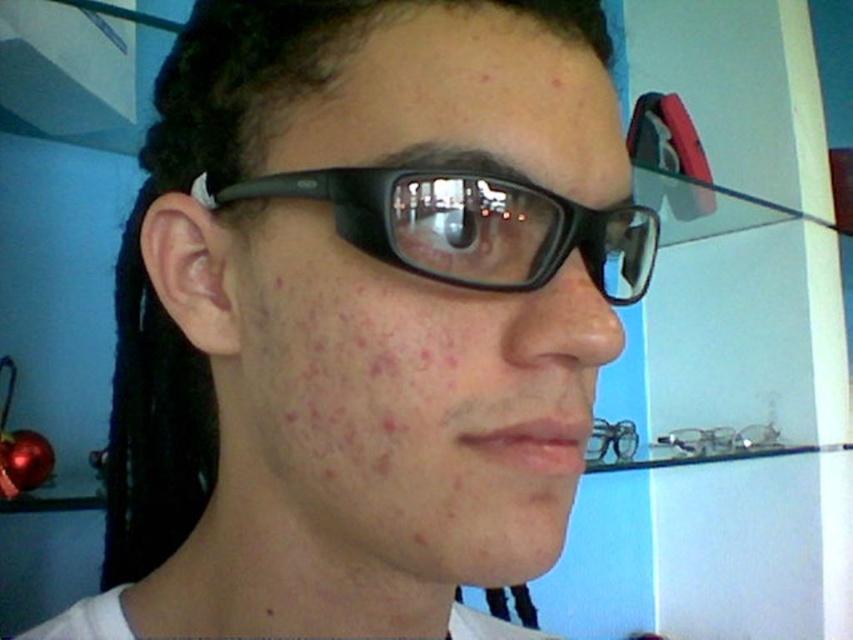
Question: Is matte black glasses at upper center positioned in front of black plastic glasses at center?

Choices:
 (A) yes
 (B) no

Answer: (B)

Question: Which of the following is the closest to the observer?

Choices:
 (A) (633, 268)
 (B) (303, 500)
 (C) (589, 108)

Answer: (C)

Question: Considering the real-world distances, which object is closest to the black plastic glasses at center?

Choices:
 (A) matte black glasses at center
 (B) matte black glasses at upper center

Answer: (B)

Question: Considering the relative positions of matte black glasses at upper center and black plastic glasses at center in the image provided, where is matte black glasses at upper center located with respect to black plastic glasses at center?

Choices:
 (A) right
 (B) left

Answer: (B)

Question: Estimate the real-world distances between objects in this image. Which object is farther from the matte black glasses at center?

Choices:
 (A) matte black glasses at upper center
 (B) black plastic glasses at center

Answer: (A)

Question: Is matte black glasses at center to the right of matte black glasses at upper center from the viewer's perspective?

Choices:
 (A) no
 (B) yes

Answer: (A)